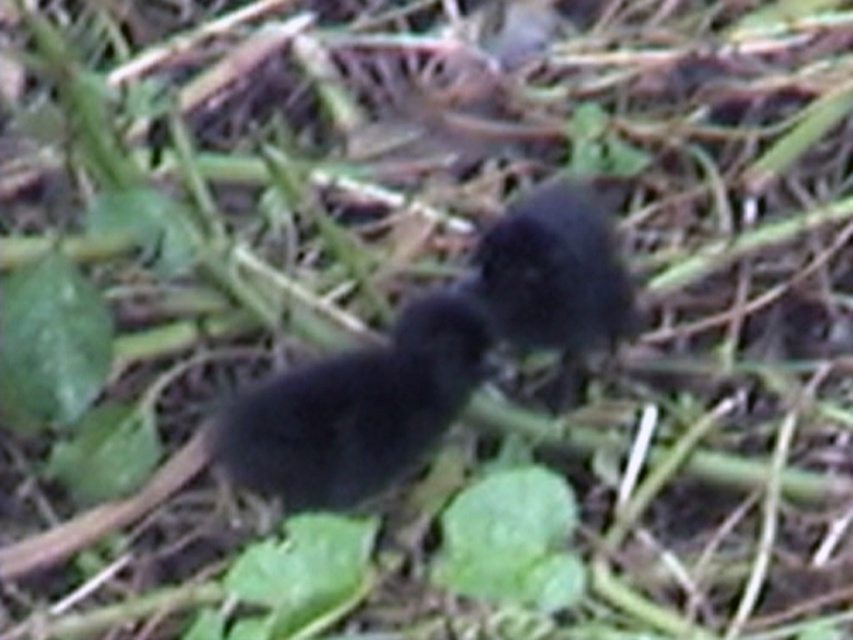
The width and height of the screenshot is (853, 640). I want to click on black matte bird at center, so click(x=357, y=410).

Does point (428, 298) come behind point (488, 240)?

No, it is not.

Where is `black matte bird at center`? black matte bird at center is located at coordinates (357, 410).